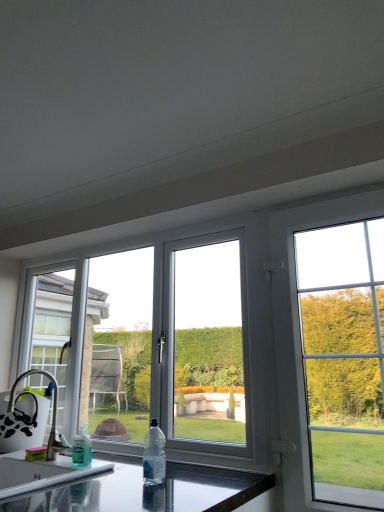
Question: From the image's perspective, is white plastic window at upper right, which appears as the second window when viewed from the left, positioned above or below black glossy countertop at lower center?

Choices:
 (A) below
 (B) above

Answer: (B)

Question: Is white plastic window at upper right, which appears as the second window when viewed from the left, to the left or to the right of black glossy countertop at lower center in the image?

Choices:
 (A) left
 (B) right

Answer: (B)

Question: Estimate the real-world distances between objects in this image. Which object is farther from the white plastic window at center, positioned as the 1th window in left-to-right order?

Choices:
 (A) white plastic window at upper right, which appears as the second window when viewed from the left
 (B) black glossy countertop at lower center
 (C) clear plastic bottle at lower left, the second bottle viewed from the front
 (D) silver metallic faucet at lower left
 (E) clear plastic bottle at center, arranged as the second bottle when viewed from the left

Answer: (E)

Question: Estimate the real-world distances between objects in this image. Which object is closer to the clear plastic bottle at lower left, the second bottle positioned from the right?

Choices:
 (A) silver metallic faucet at lower left
 (B) clear plastic bottle at center, the 1th bottle from the front
 (C) white plastic window at center, positioned as the 1th window in left-to-right order
 (D) black glossy countertop at lower center
 (E) white plastic window at upper right, the 1th window from the right

Answer: (A)